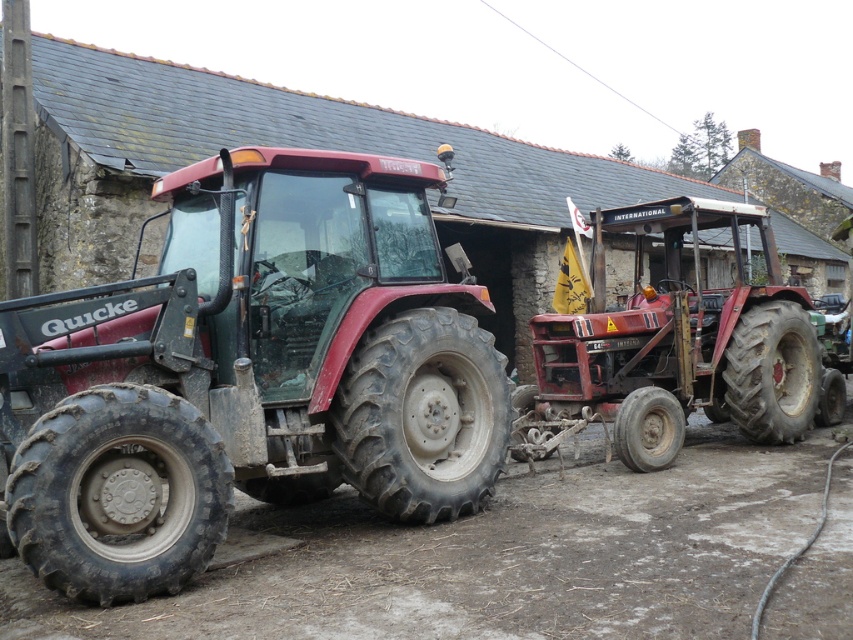
You are standing at the origin point of the coordinate system in the image. You want to move towards the matte red tractor at left. What direction should you move in?

Since the matte red tractor at left is located at coordinate point 0.584 on the x axis and 0.292 on the y axis, you should move towards the right and slightly forward to reach it.

You are standing at the back of the image looking towards the tractors. Which of the two points, point (482, 460) or point (758, 433), is closer to you?

Point (758, 433) is closer to you because it is behind point (482, 460).